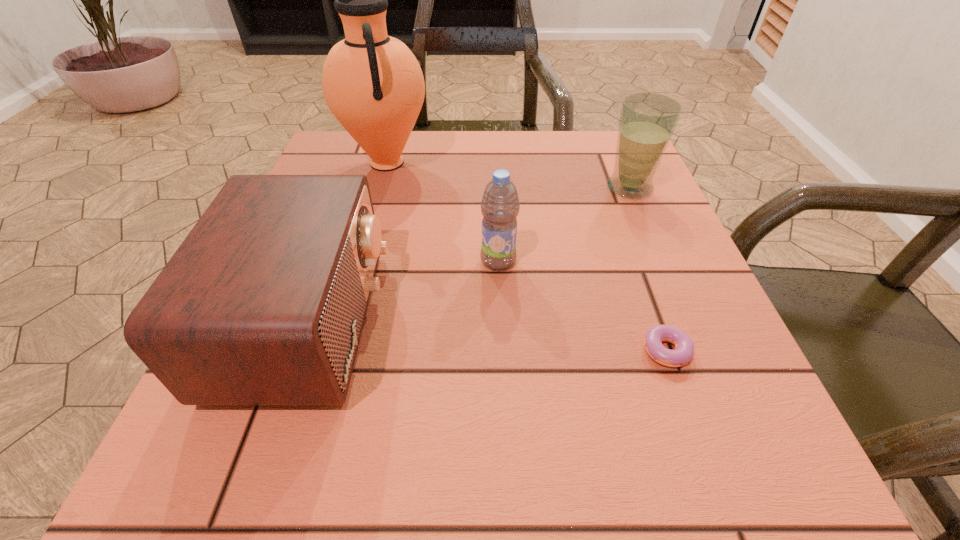
Locate an element on the screen. vacant point located between the pitcher and the shortest object is located at coordinates (530, 257).

Locate an element on the screen. The height and width of the screenshot is (540, 960). object that stands as the second closest to the doughnut is located at coordinates (647, 122).

Image resolution: width=960 pixels, height=540 pixels. Identify the location of object that is the third closest to the doughnut. (263, 303).

Identify the location of free location that satisfies the following two spatial constraints: 1. on the front side of the doughnut; 2. on the left side of the tallest object. (333, 351).

The image size is (960, 540). Identify the location of free space that satisfies the following two spatial constraints: 1. on the front panel of the radio receiver; 2. on the back side of the shortest object. (298, 351).

Identify the location of free region that satisfies the following two spatial constraints: 1. on the front panel of the shortest object; 2. on the right side of the radio receiver. This screenshot has height=540, width=960. 298,351.

Identify the location of free space that satisfies the following two spatial constraints: 1. on the front side of the shortest object; 2. on the left side of the third object from left to right. (502, 351).

Where is `free location that satisfies the following two spatial constraints: 1. on the front side of the water bottle; 2. on the left side of the shortest object`? The height and width of the screenshot is (540, 960). free location that satisfies the following two spatial constraints: 1. on the front side of the water bottle; 2. on the left side of the shortest object is located at coordinates (502, 351).